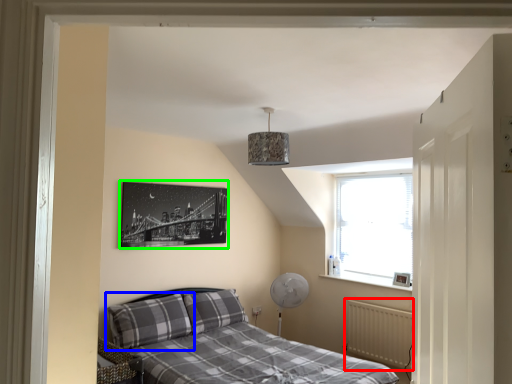
Question: Considering the real-world distances, which object is farthest from radiator (highlighted by a red box)? pillow (highlighted by a blue box) or picture frame (highlighted by a green box)?

Choices:
 (A) pillow
 (B) picture frame

Answer: (B)